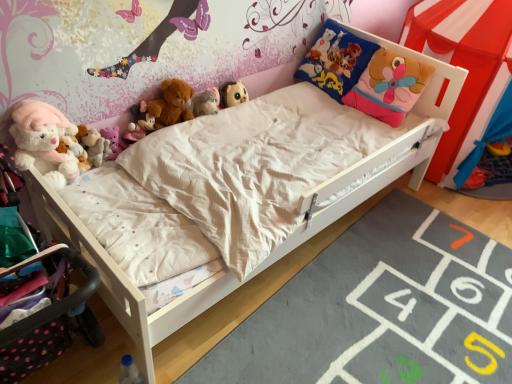
This screenshot has height=384, width=512. I want to click on free space above gray soft rug at lower right (from a real-world perspective), so click(393, 310).